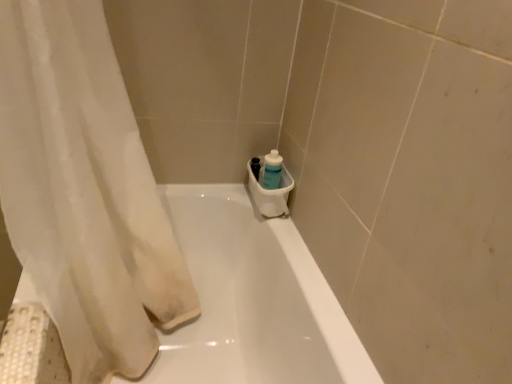
Question: Is translucent plastic bottle at lower right bigger than white glossy bathtub at center?

Choices:
 (A) no
 (B) yes

Answer: (A)

Question: Does translucent plastic bottle at lower right have a greater width compared to white glossy bathtub at center?

Choices:
 (A) no
 (B) yes

Answer: (A)

Question: Does translucent plastic bottle at lower right have a lesser height compared to white glossy bathtub at center?

Choices:
 (A) no
 (B) yes

Answer: (B)

Question: Does translucent plastic bottle at lower right appear on the right side of white glossy bathtub at center?

Choices:
 (A) yes
 (B) no

Answer: (A)

Question: Does translucent plastic bottle at lower right lie behind white glossy bathtub at center?

Choices:
 (A) yes
 (B) no

Answer: (A)

Question: Is point (75, 215) positioned closer to the camera than point (242, 294)?

Choices:
 (A) closer
 (B) farther

Answer: (A)

Question: Looking at their shapes, would you say white sheer curtain at left is wider or thinner than white glossy bathtub at center?

Choices:
 (A) wide
 (B) thin

Answer: (B)

Question: Is white sheer curtain at left taller or shorter than white glossy bathtub at center?

Choices:
 (A) tall
 (B) short

Answer: (A)

Question: Based on their sizes in the image, would you say white sheer curtain at left is bigger or smaller than white glossy bathtub at center?

Choices:
 (A) small
 (B) big

Answer: (A)

Question: From a real-world perspective, is translucent plastic bottle at lower right physically located above or below white glossy bathtub at center?

Choices:
 (A) above
 (B) below

Answer: (A)

Question: From the image's perspective, is translucent plastic bottle at lower right located above or below white glossy bathtub at center?

Choices:
 (A) below
 (B) above

Answer: (B)

Question: Do you think translucent plastic bottle at lower right is within white glossy bathtub at center, or outside of it?

Choices:
 (A) inside
 (B) outside

Answer: (B)

Question: Looking at their shapes, would you say translucent plastic bottle at lower right is wider or thinner than white glossy bathtub at center?

Choices:
 (A) thin
 (B) wide

Answer: (A)

Question: In terms of height, does white glossy bathtub at center look taller or shorter compared to translucent plastic bottle at lower right?

Choices:
 (A) tall
 (B) short

Answer: (A)

Question: Is white glossy bathtub at center inside or outside of translucent plastic bottle at lower right?

Choices:
 (A) inside
 (B) outside

Answer: (B)